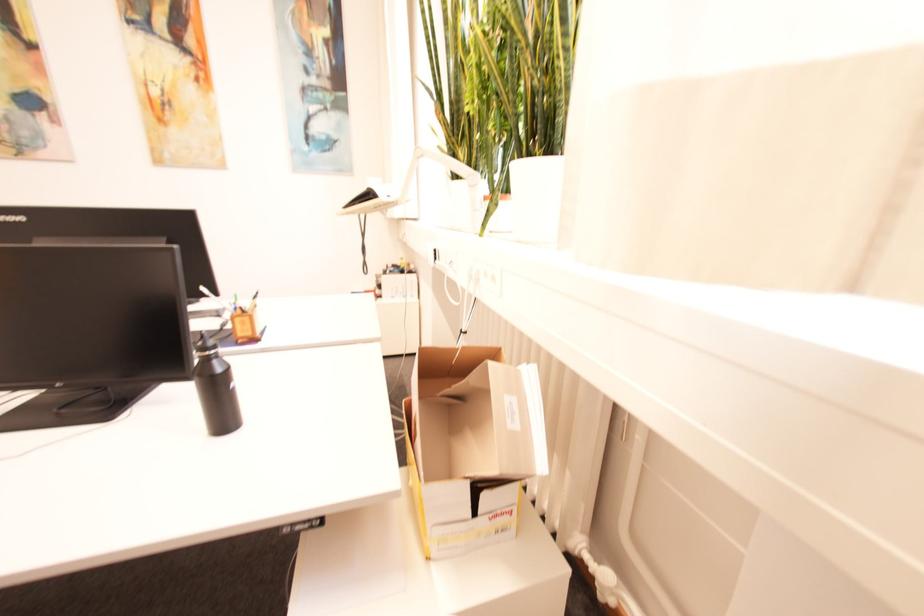
Find where to lift the white plant pot. Please return your answer as a coordinate pair (x, y).

(536, 198)